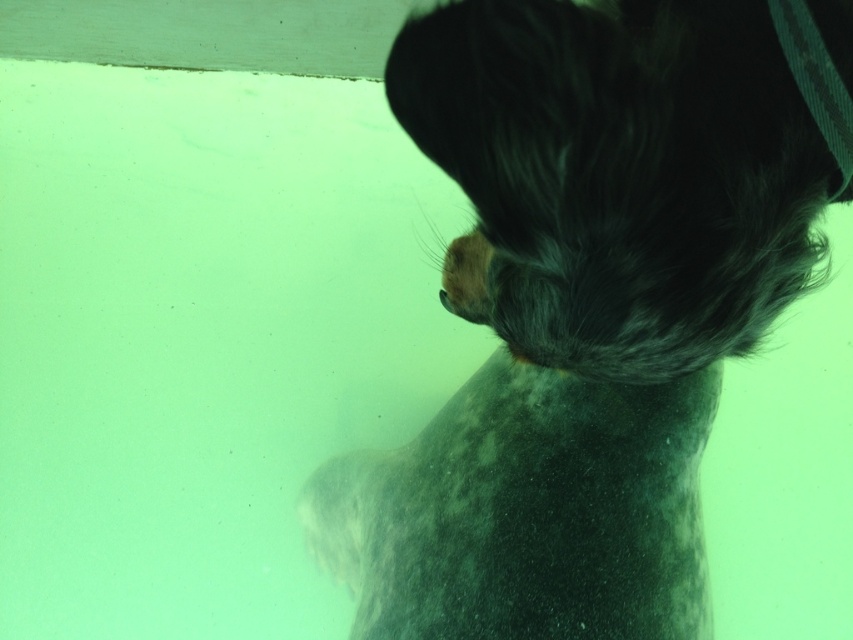
Question: Among these objects, which one is farthest from the camera?

Choices:
 (A) dark blue textured fabric at upper right
 (B) fluffy gray dog at upper right

Answer: (A)

Question: Which point is closer to the camera?

Choices:
 (A) (851, 156)
 (B) (322, 499)
 (C) (670, 262)

Answer: (C)

Question: Can you confirm if white fur paw at lower center is wider than dark blue textured fabric at upper right?

Choices:
 (A) no
 (B) yes

Answer: (B)

Question: Is fluffy gray dog at upper right smaller than white fur paw at lower center?

Choices:
 (A) no
 (B) yes

Answer: (A)

Question: Which point is closer to the camera?

Choices:
 (A) (647, 476)
 (B) (310, 493)

Answer: (A)

Question: In this image, where is fluffy gray dog at upper right located relative to white fur paw at lower center?

Choices:
 (A) below
 (B) above

Answer: (B)